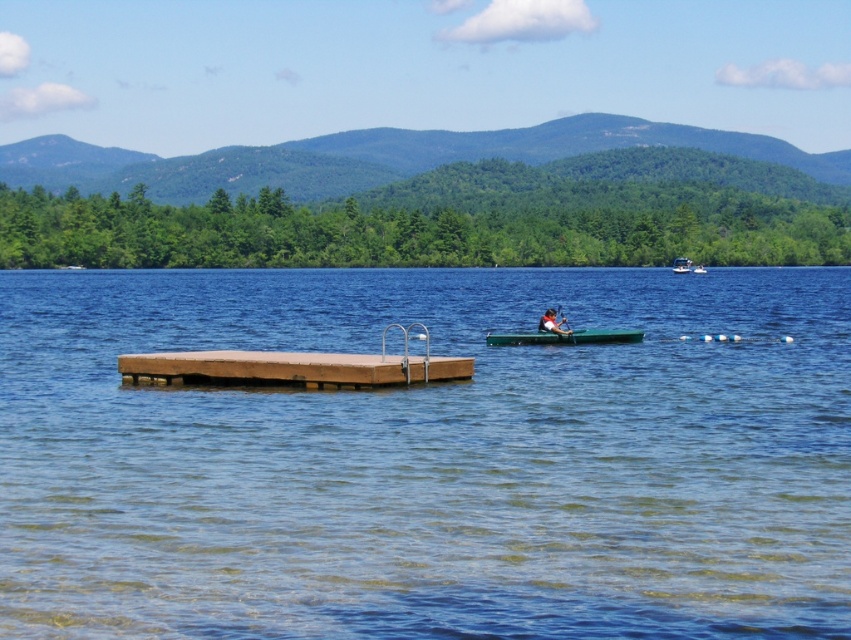
Question: Estimate the real-world distances between objects in this image. Which object is closer to the clear water at center?

Choices:
 (A) green plastic paddle at center
 (B) green plastic boat at upper right
 (C) smooth green canoe at center
 (D) matte black canoe at center

Answer: (D)

Question: Which of these objects is positioned closest to the smooth green canoe at center?

Choices:
 (A) green plastic paddle at center
 (B) clear water at center
 (C) brown wood dock at center

Answer: (A)

Question: In this image, where is clear water at center located relative to brown wood dock at center?

Choices:
 (A) left
 (B) right

Answer: (B)

Question: Does brown wood dock at center come in front of green plastic boat at upper right?

Choices:
 (A) no
 (B) yes

Answer: (B)

Question: Which point is closer to the camera?

Choices:
 (A) brown wood dock at center
 (B) green plastic boat at upper right

Answer: (A)

Question: Does clear water at center appear over brown wood dock at center?

Choices:
 (A) no
 (B) yes

Answer: (B)